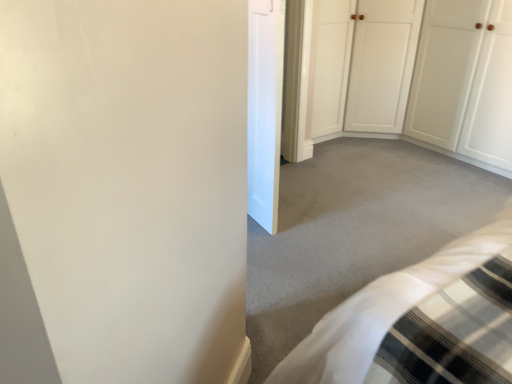
Question: Is white smooth door at center, which is the second door in right-to-left order, wider or thinner than white wood door at upper right, the 2th door positioned from the left?

Choices:
 (A) thin
 (B) wide

Answer: (A)

Question: Is white smooth door at center, the 2th door from the back, taller or shorter than white wood door at upper right, which appears as the 2th door when viewed from the front?

Choices:
 (A) short
 (B) tall

Answer: (B)

Question: Considering the positions of point (267, 208) and point (483, 84), is point (267, 208) closer or farther from the camera than point (483, 84)?

Choices:
 (A) closer
 (B) farther

Answer: (A)

Question: From the image's perspective, is white wood door at upper right, the 2th door positioned from the left, positioned above or below white smooth door at center, the 2th door from the back?

Choices:
 (A) below
 (B) above

Answer: (B)

Question: In the image, is white wood door at upper right, the 2th door positioned from the left, positioned in front of or behind white smooth door at center, which is counted as the first door, starting from the front?

Choices:
 (A) front
 (B) behind

Answer: (B)

Question: Would you say white wood door at upper right, the 2th door positioned from the left, is to the left or to the right of white smooth door at center, which is counted as the first door, starting from the front, in the picture?

Choices:
 (A) right
 (B) left

Answer: (A)

Question: Is white wood door at upper right, the 2th door positioned from the left, inside or outside of white smooth door at center, the 2th door from the back?

Choices:
 (A) inside
 (B) outside

Answer: (B)